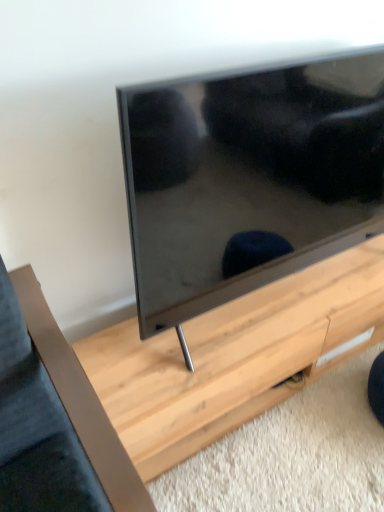
Question: Is light wood table at center shorter than matte black tv at center?

Choices:
 (A) yes
 (B) no

Answer: (A)

Question: From a real-world perspective, is light wood table at center beneath matte black tv at center?

Choices:
 (A) yes
 (B) no

Answer: (A)

Question: From the image's perspective, is light wood table at center above matte black tv at center?

Choices:
 (A) yes
 (B) no

Answer: (B)

Question: Does light wood table at center appear on the left side of matte black tv at center?

Choices:
 (A) yes
 (B) no

Answer: (B)

Question: Is light wood table at center oriented towards matte black tv at center?

Choices:
 (A) no
 (B) yes

Answer: (A)

Question: Is light wood table at center facing away from matte black tv at center?

Choices:
 (A) no
 (B) yes

Answer: (A)

Question: Considering the relative positions of matte black tv at center and light wood table at center in the image provided, is matte black tv at center to the right of light wood table at center from the viewer's perspective?

Choices:
 (A) yes
 (B) no

Answer: (B)

Question: Is matte black tv at center wider than light wood table at center?

Choices:
 (A) no
 (B) yes

Answer: (A)

Question: From the image's perspective, is matte black tv at center above light wood table at center?

Choices:
 (A) yes
 (B) no

Answer: (A)

Question: Is matte black tv at center taller than light wood table at center?

Choices:
 (A) no
 (B) yes

Answer: (B)

Question: Is light wood table at center completely or partially inside matte black tv at center?

Choices:
 (A) yes
 (B) no

Answer: (B)

Question: From a real-world perspective, is matte black tv at center located beneath light wood table at center?

Choices:
 (A) yes
 (B) no

Answer: (B)

Question: From a real-world perspective, relative to light wood table at center, is matte black tv at center vertically above or below?

Choices:
 (A) above
 (B) below

Answer: (A)